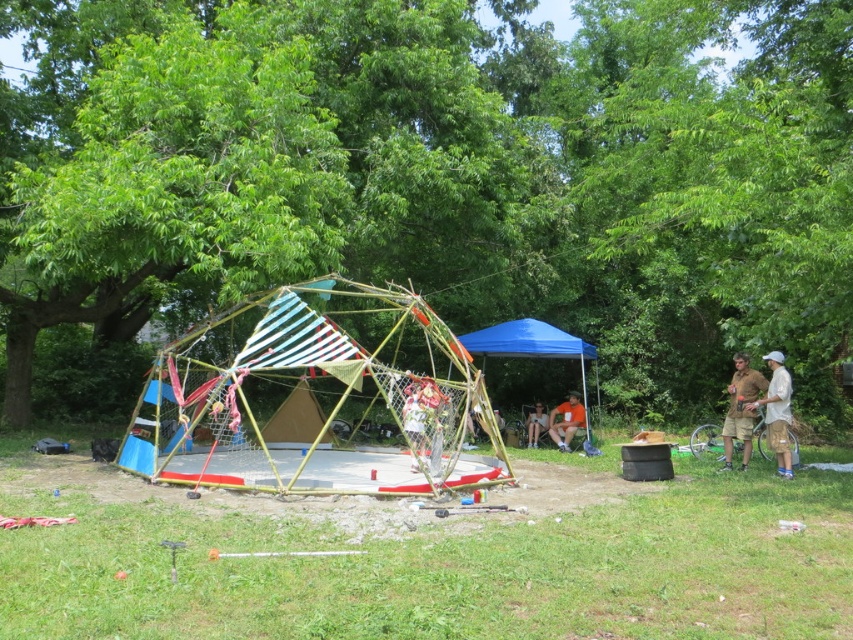
Question: Does wooden frame tent at center appear on the right side of floral fabric dress at center?

Choices:
 (A) no
 (B) yes

Answer: (A)

Question: Among these points, which one is farthest from the camera?

Choices:
 (A) (538, 328)
 (B) (415, 454)

Answer: (A)

Question: Can you confirm if wooden frame tent at center is positioned below brown fabric shorts at right?

Choices:
 (A) yes
 (B) no

Answer: (B)

Question: Does green leafy tree at center appear over blue fabric tent at center?

Choices:
 (A) yes
 (B) no

Answer: (A)

Question: Which point is farther to the camera?

Choices:
 (A) white cotton shirt at right
 (B) wooden frame tent at center

Answer: (A)

Question: Considering the real-world distances, which object is farthest from the green leafy tree at center?

Choices:
 (A) orange fabric at lower center
 (B) white cotton shirt at right

Answer: (B)